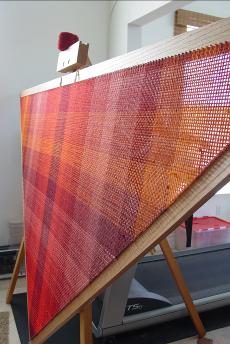
Locate an element on the screen. Image resolution: width=230 pixels, height=344 pixels. edges of window is located at coordinates (226, 190), (191, 27).